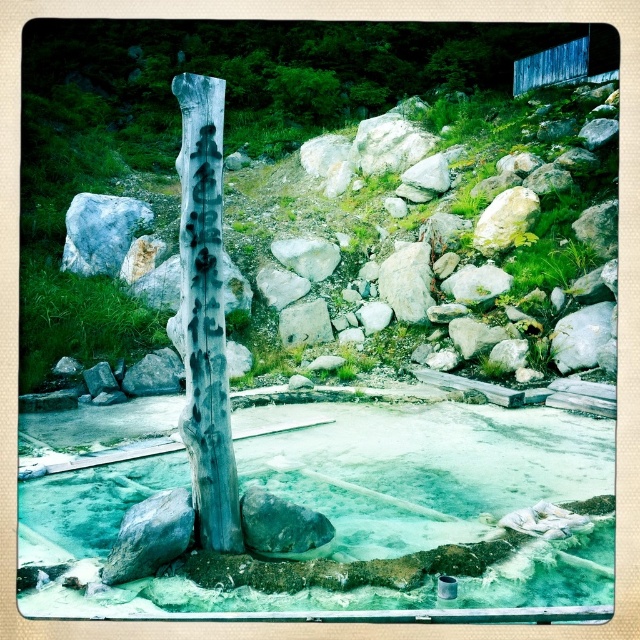
The width and height of the screenshot is (640, 640). What do you see at coordinates (323, 513) in the screenshot?
I see `greenish stone pool at center` at bounding box center [323, 513].

Can you confirm if greenish stone pool at center is thinner than gray wood tree trunk at center?

No.

Is point (280, 576) positioned before point (192, 465)?

Yes, point (280, 576) is in front of point (192, 465).

This screenshot has width=640, height=640. I want to click on greenish stone pool at center, so click(x=323, y=513).

Consider the image. Measure the distance from gray wood tree trunk at center to gray rock at center.

gray wood tree trunk at center and gray rock at center are 7.29 meters apart.

Is gray wood tree trunk at center bigger than gray rock at center?

Yes, gray wood tree trunk at center is bigger than gray rock at center.

This screenshot has width=640, height=640. Describe the element at coordinates (205, 316) in the screenshot. I see `gray wood tree trunk at center` at that location.

Find the location of a particular element. The height and width of the screenshot is (640, 640). gray wood tree trunk at center is located at coordinates (205, 316).

Looking at this image, can you confirm if greenish stone pool at center is positioned to the right of gray rock at center?

Yes, greenish stone pool at center is to the right of gray rock at center.

Is point (144, 403) positioned in front of point (323, 317)?

Yes, point (144, 403) is in front of point (323, 317).

This screenshot has height=640, width=640. Describe the element at coordinates (323, 513) in the screenshot. I see `greenish stone pool at center` at that location.

Find the location of a particular element. This screenshot has width=640, height=640. greenish stone pool at center is located at coordinates (323, 513).